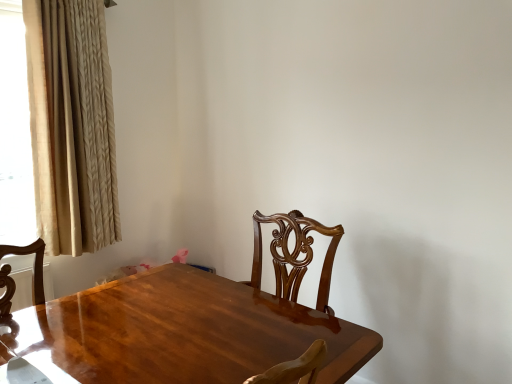
Question: Considering the relative positions of glossy wood table at center and beige textured curtain at left in the image provided, is glossy wood table at center to the right of beige textured curtain at left from the viewer's perspective?

Choices:
 (A) no
 (B) yes

Answer: (B)

Question: Considering the relative sizes of glossy wood table at center and beige textured curtain at left in the image provided, is glossy wood table at center thinner than beige textured curtain at left?

Choices:
 (A) no
 (B) yes

Answer: (A)

Question: Is beige textured curtain at left at the back of glossy wood table at center?

Choices:
 (A) yes
 (B) no

Answer: (B)

Question: Is glossy wood table at center to the left of beige textured curtain at left from the viewer's perspective?

Choices:
 (A) no
 (B) yes

Answer: (A)

Question: From the image's perspective, is glossy wood table at center under beige textured curtain at left?

Choices:
 (A) no
 (B) yes

Answer: (B)

Question: Considering the relative sizes of glossy wood table at center and beige textured curtain at left in the image provided, is glossy wood table at center shorter than beige textured curtain at left?

Choices:
 (A) yes
 (B) no

Answer: (A)

Question: From a real-world perspective, is beige textured curtain at left over glossy wood table at center?

Choices:
 (A) no
 (B) yes

Answer: (B)

Question: From the image's perspective, is beige textured curtain at left on glossy wood table at center?

Choices:
 (A) yes
 (B) no

Answer: (A)

Question: Does beige textured curtain at left have a lesser height compared to glossy wood table at center?

Choices:
 (A) no
 (B) yes

Answer: (A)

Question: Could you tell me if beige textured curtain at left is turned towards glossy wood table at center?

Choices:
 (A) yes
 (B) no

Answer: (B)

Question: Would you consider beige textured curtain at left to be distant from glossy wood table at center?

Choices:
 (A) no
 (B) yes

Answer: (B)

Question: Is beige textured curtain at left wider than glossy wood table at center?

Choices:
 (A) yes
 (B) no

Answer: (B)

Question: From a real-world perspective, is beige textured curtain at left positioned above or below glossy wood table at center?

Choices:
 (A) above
 (B) below

Answer: (A)